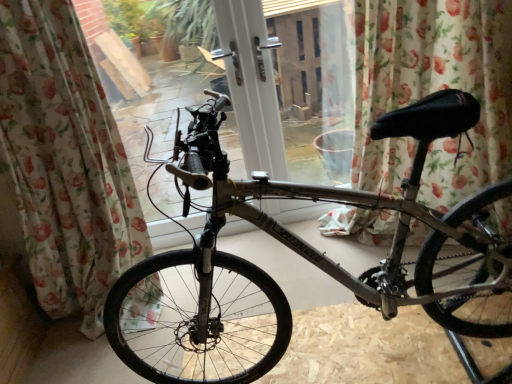
Question: Is floral fabric curtain at center, arranged as the second curtain when viewed from the left, not within silver metallic bicycle at center?

Choices:
 (A) yes
 (B) no

Answer: (A)

Question: From the image's perspective, is floral fabric curtain at center, positioned as the first curtain in right-to-left order, above silver metallic bicycle at center?

Choices:
 (A) no
 (B) yes

Answer: (B)

Question: Considering the relative positions of floral fabric curtain at center, positioned as the first curtain in right-to-left order, and silver metallic bicycle at center in the image provided, is floral fabric curtain at center, positioned as the first curtain in right-to-left order, to the right of silver metallic bicycle at center from the viewer's perspective?

Choices:
 (A) no
 (B) yes

Answer: (B)

Question: Is floral fabric curtain at center, arranged as the second curtain when viewed from the left, to the left of silver metallic bicycle at center from the viewer's perspective?

Choices:
 (A) yes
 (B) no

Answer: (B)

Question: From a real-world perspective, is floral fabric curtain at center, arranged as the second curtain when viewed from the left, beneath silver metallic bicycle at center?

Choices:
 (A) no
 (B) yes

Answer: (A)

Question: Is the surface of floral fabric curtain at center, positioned as the first curtain in right-to-left order, in direct contact with silver metallic bicycle at center?

Choices:
 (A) yes
 (B) no

Answer: (B)

Question: Is silver metallic bicycle at center with floral fabric curtain at center, positioned as the first curtain in right-to-left order?

Choices:
 (A) yes
 (B) no

Answer: (B)

Question: From the image's perspective, is silver metallic bicycle at center over floral fabric curtain at center, positioned as the first curtain in right-to-left order?

Choices:
 (A) no
 (B) yes

Answer: (A)

Question: Is silver metallic bicycle at center thinner than floral fabric curtain at center, positioned as the first curtain in right-to-left order?

Choices:
 (A) yes
 (B) no

Answer: (B)

Question: Can you confirm if silver metallic bicycle at center is positioned to the right of floral fabric curtain at center, arranged as the second curtain when viewed from the left?

Choices:
 (A) yes
 (B) no

Answer: (B)

Question: Is floral fabric curtain at center, arranged as the second curtain when viewed from the left, at the back of silver metallic bicycle at center?

Choices:
 (A) yes
 (B) no

Answer: (B)

Question: From the image's perspective, would you say silver metallic bicycle at center is shown under floral fabric curtain at center, arranged as the second curtain when viewed from the left?

Choices:
 (A) yes
 (B) no

Answer: (A)

Question: Is floral fabric curtain at left, positioned as the 1th curtain in left-to-right order, outside of floral fabric curtain at center, arranged as the second curtain when viewed from the left?

Choices:
 (A) no
 (B) yes

Answer: (B)